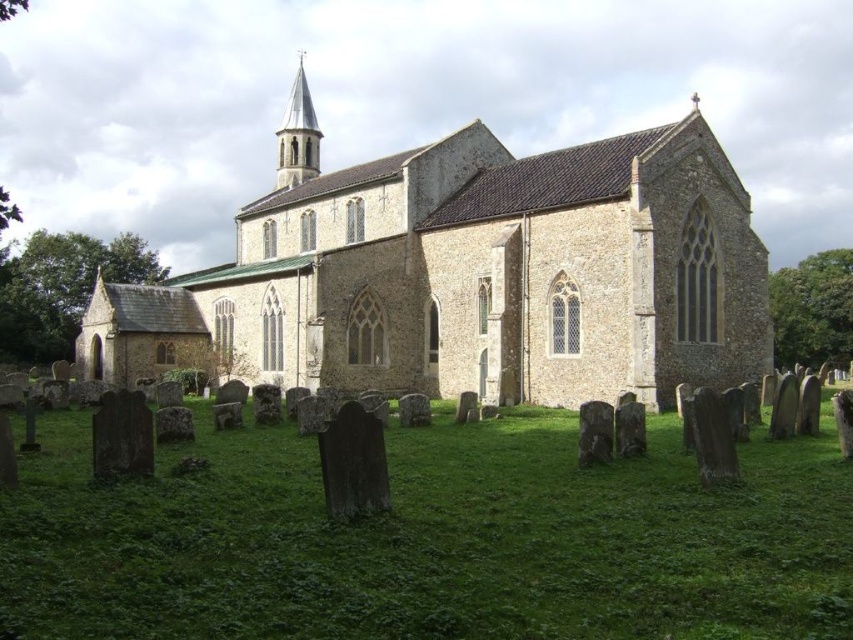
Does green grass at lower center have a greater height compared to stone church at center?

No, green grass at lower center is not taller than stone church at center.

Measure the distance from green grass at lower center to stone church at center.

They are 29.94 meters apart.

The height and width of the screenshot is (640, 853). Describe the element at coordinates (431, 540) in the screenshot. I see `green grass at lower center` at that location.

I want to click on green grass at lower center, so click(431, 540).

Is green grass at lower center below white stone spire at upper center?

Yes.

Which of these two, green grass at lower center or white stone spire at upper center, stands shorter?

green grass at lower center

Is point (693, 492) behind point (312, 148)?

No, it is in front of (312, 148).

You are a GUI agent. You are given a task and a screenshot of the screen. Output one action in this format:
    pyautogui.click(x=<x>, y=<y>)
    Task: Click on the green grass at lower center
    
    Given the screenshot: What is the action you would take?
    pyautogui.click(x=431, y=540)

Between stone church at center and white stone spire at upper center, which one is positioned higher?

white stone spire at upper center is above.

Between stone church at center and white stone spire at upper center, which one has more height?

white stone spire at upper center

What are the coordinates of `stone church at center` in the screenshot? It's located at (473, 276).

Where is `stone church at center`? The height and width of the screenshot is (640, 853). stone church at center is located at coordinates (473, 276).